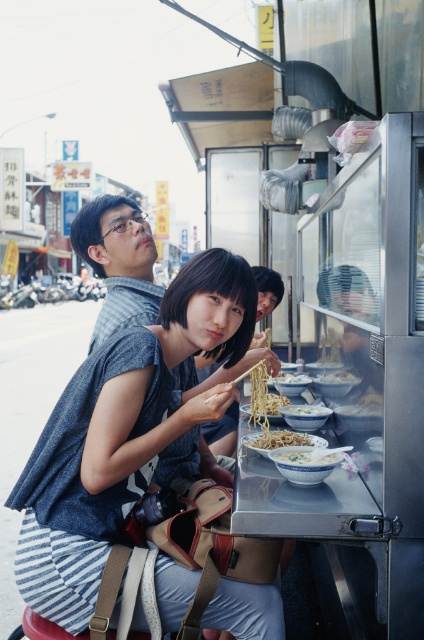
Question: Where is matte blue shirt at upper left located in relation to white glossy bowl at center in the image?

Choices:
 (A) below
 (B) above

Answer: (B)

Question: Which point is closer to the camera taking this photo?

Choices:
 (A) (267, 433)
 (B) (133, 376)
 (C) (326, 454)

Answer: (B)

Question: Which of the following is the closest to the observer?

Choices:
 (A) white matte bowl at center
 (B) matte blue shirt at upper left
 (C) white matte noodles at center
 (D) denim shirt at center

Answer: (D)

Question: Considering the relative positions of matte blue shirt at upper left and white matte bowl at center in the image provided, where is matte blue shirt at upper left located with respect to white matte bowl at center?

Choices:
 (A) right
 (B) left

Answer: (B)

Question: Does matte blue shirt at upper left have a greater width compared to white matte bowl at center?

Choices:
 (A) no
 (B) yes

Answer: (B)

Question: Which of the following is the farthest from the observer?

Choices:
 (A) (156, 285)
 (B) (278, 440)
 (C) (315, 445)

Answer: (A)